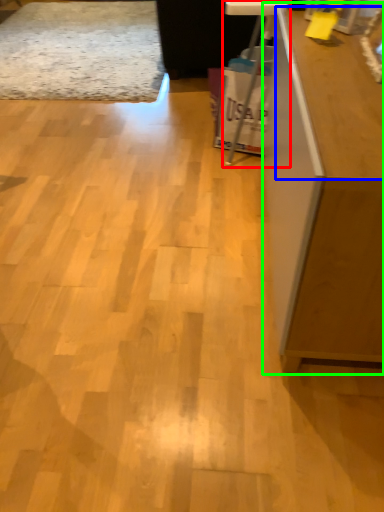
Question: Considering the real-world distances, which object is closest to computer desk (highlighted by a red box)? counter top (highlighted by a blue box) or furniture (highlighted by a green box).

Choices:
 (A) counter top
 (B) furniture

Answer: (A)